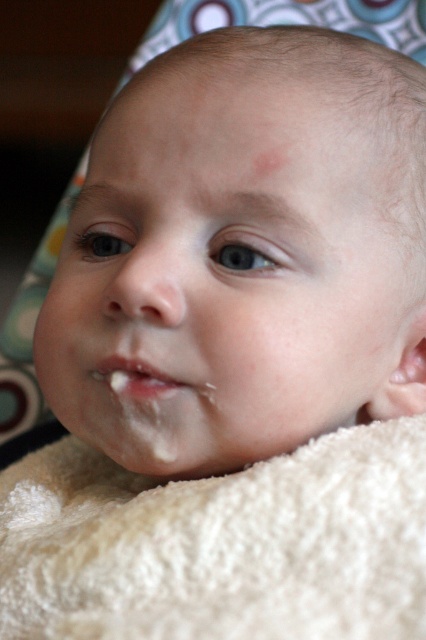
Where is the smooth skin baby face at center located in the image?

The smooth skin baby face at center is located at point coordinates of 0.434 on the x axis and 0.545 on the y axis.

Based on the scene description, can you determine which object is wider between the smooth skin baby face at center and the white matte lip at center?

The smooth skin baby face at center is wider than the white matte lip at center.

You are a photographer adjusting the lighting for a baby photo shoot. You have two key points to focus on for optimal lighting. The first is point (256, 358) and the second is point (166, 387). Since you want to ensure the light reaches both points, which point should you place closer to the light source to make sure both are well illuminated?

Point (256, 358) is in front of point (166, 387). To ensure both points are well illuminated, you should place the light source closer to point (166, 387) since it is further away from the light compared to the front point.